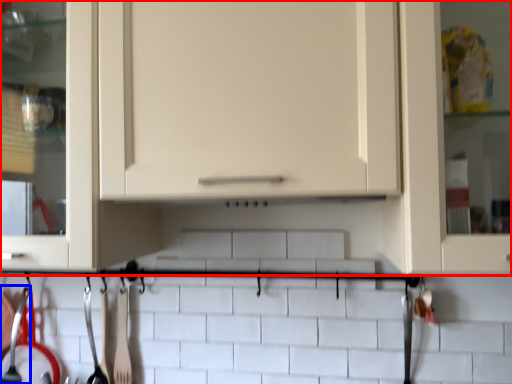
Question: Which object is further to the camera taking this photo, cabinetry (highlighted by a red box) or silverware (highlighted by a blue box)?

Choices:
 (A) cabinetry
 (B) silverware

Answer: (B)